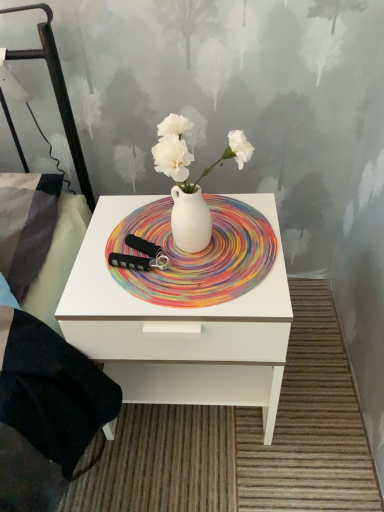
This screenshot has width=384, height=512. Identify the location of vacant area that lies to the right of white matte vase at center. (265, 237).